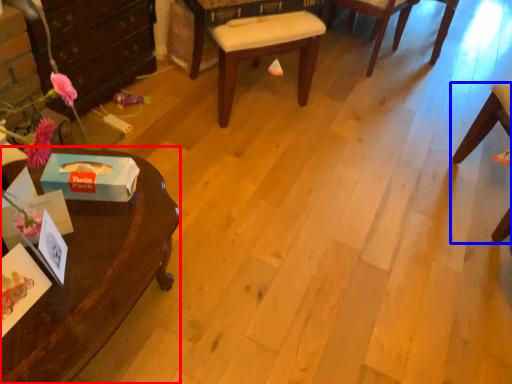
Question: Which object appears closest to the camera in this image, desk (highlighted by a red box) or chair (highlighted by a blue box)?

Choices:
 (A) desk
 (B) chair

Answer: (A)